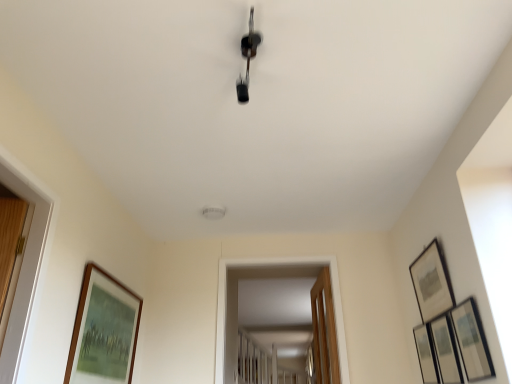
Question: From the image's perspective, does wooden framed picture at right, acting as the second picture frame starting from the right, appear lower than metallic silver picture frame at right, the first picture frame from the right?

Choices:
 (A) no
 (B) yes

Answer: (A)

Question: Does wooden framed picture at right, acting as the second picture frame starting from the right, have a smaller size compared to metallic silver picture frame at right, the first picture frame from the right?

Choices:
 (A) yes
 (B) no

Answer: (B)

Question: Is wooden framed picture at right, which is the fourth picture frame from left to right, shorter than metallic silver picture frame at right, which is the 5th picture frame from left to right?

Choices:
 (A) yes
 (B) no

Answer: (A)

Question: Does wooden framed picture at right, which is the fourth picture frame from left to right, have a larger size compared to metallic silver picture frame at right, the first picture frame from the right?

Choices:
 (A) yes
 (B) no

Answer: (A)

Question: Is wooden framed picture at right, which is the fourth picture frame from left to right, thinner than metallic silver picture frame at right, the first picture frame from the right?

Choices:
 (A) yes
 (B) no

Answer: (B)

Question: Considering the relative positions of wooden framed picture at right, which is the fourth picture frame from left to right, and metallic silver picture frame at right, which is the 5th picture frame from left to right, in the image provided, is wooden framed picture at right, which is the fourth picture frame from left to right, to the right of metallic silver picture frame at right, which is the 5th picture frame from left to right, from the viewer's perspective?

Choices:
 (A) yes
 (B) no

Answer: (B)

Question: Is metallic silver picture frame at right, the first picture frame from the right, looking in the opposite direction of wooden door at center?

Choices:
 (A) yes
 (B) no

Answer: (B)

Question: Is metallic silver picture frame at right, which is the 5th picture frame from left to right, further to camera compared to wooden door at center?

Choices:
 (A) yes
 (B) no

Answer: (B)

Question: Can you confirm if metallic silver picture frame at right, which is the 5th picture frame from left to right, is wider than wooden door at center?

Choices:
 (A) no
 (B) yes

Answer: (A)

Question: Considering the relative sizes of metallic silver picture frame at right, which is the 5th picture frame from left to right, and wooden door at center in the image provided, is metallic silver picture frame at right, which is the 5th picture frame from left to right, smaller than wooden door at center?

Choices:
 (A) no
 (B) yes

Answer: (B)

Question: Is metallic silver picture frame at right, which is the 5th picture frame from left to right, not inside wooden door at center?

Choices:
 (A) no
 (B) yes

Answer: (B)

Question: Considering the relative positions of metallic silver picture frame at right, which is the 5th picture frame from left to right, and wooden door at center in the image provided, is metallic silver picture frame at right, which is the 5th picture frame from left to right, to the right of wooden door at center from the viewer's perspective?

Choices:
 (A) yes
 (B) no

Answer: (A)

Question: Is wooden framed picture at right, which is the fourth picture frame from left to right, at the left side of matte black picture frame at upper right, which appears as the third picture frame when viewed from the left?

Choices:
 (A) no
 (B) yes

Answer: (A)